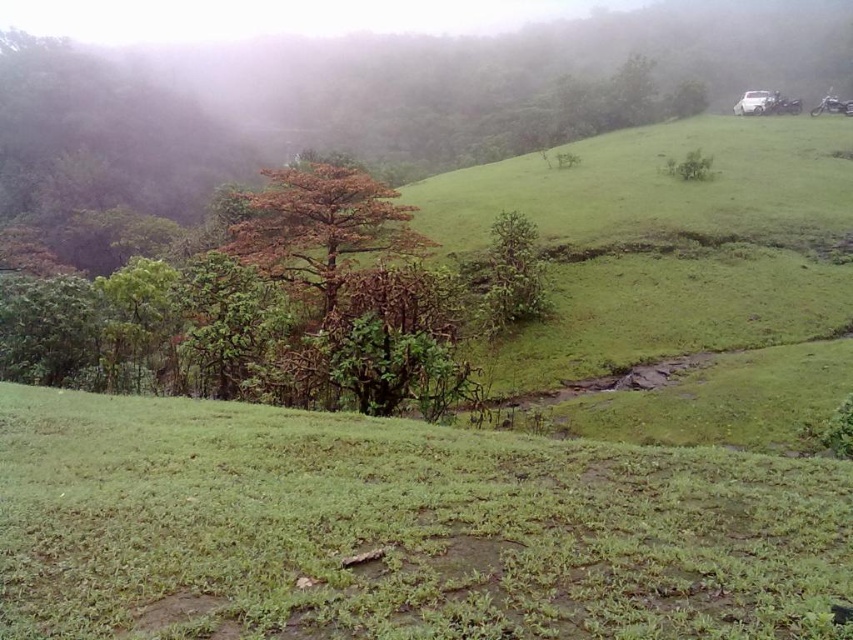
Question: Among these points, which one is farthest from the camera?

Choices:
 (A) (9, 577)
 (B) (381, 220)

Answer: (B)

Question: Does green grassy at lower center appear on the right side of brown/dried wood tree at center?

Choices:
 (A) yes
 (B) no

Answer: (A)

Question: Observing the image, what is the correct spatial positioning of green grassy at lower center in reference to brown/dried wood tree at center?

Choices:
 (A) left
 (B) right

Answer: (B)

Question: Where is green grassy at lower center located in relation to brown/dried wood tree at center in the image?

Choices:
 (A) above
 (B) below

Answer: (B)

Question: Which point is closer to the camera?

Choices:
 (A) (271, 428)
 (B) (294, 252)

Answer: (A)

Question: Which of the following is the closest to the observer?

Choices:
 (A) brown/dried wood tree at center
 (B) green grassy at lower center

Answer: (B)